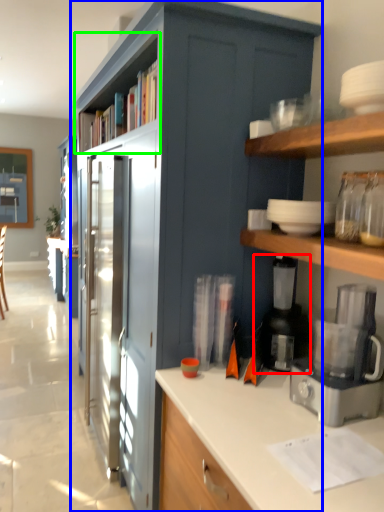
Question: Which is nearer to the appliance (highlighted by a red box)? cabinetry (highlighted by a blue box) or shelf (highlighted by a green box).

Choices:
 (A) cabinetry
 (B) shelf

Answer: (A)